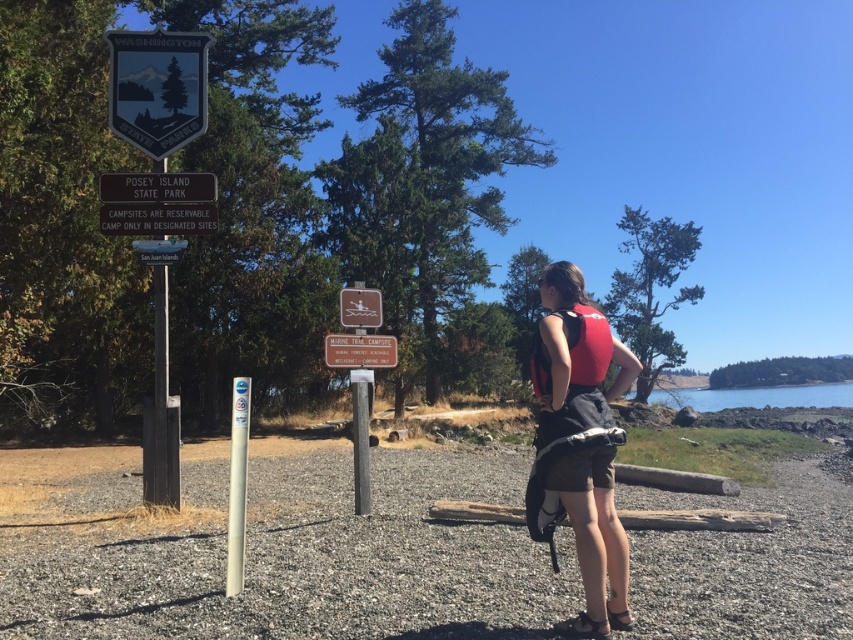
You are a visitor at Posey Island State Park and want to locate the metallic blue sign at upper center and the clear blue water at lower right. Which object is closer to the ground?

The metallic blue sign at upper center is shorter than clear blue water at lower right, so the metallic blue sign at upper center is closer to the ground.